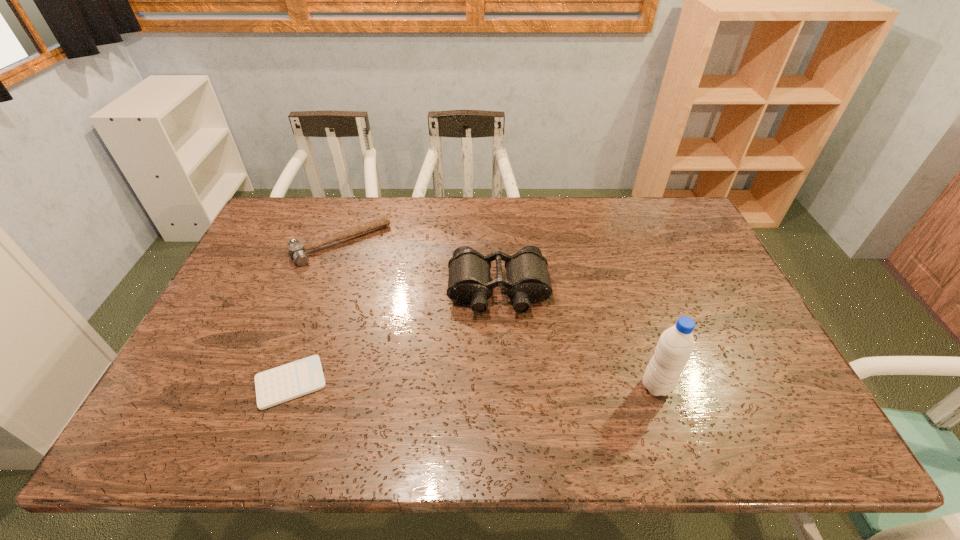
Find the location of a particular element. This screenshot has height=540, width=960. empty space that is in between the tallest object and the shortest object is located at coordinates (473, 384).

The image size is (960, 540). What are the coordinates of `vacant area that lies between the hammer and the calculator` in the screenshot? It's located at (316, 313).

The width and height of the screenshot is (960, 540). I want to click on vacant area between the second shortest object and the binoculars, so click(x=420, y=267).

The width and height of the screenshot is (960, 540). In order to click on empty location between the rightmost object and the shortest object in this screenshot , I will do `click(473, 384)`.

Locate an element on the screen. The image size is (960, 540). free spot between the tallest object and the third tallest object is located at coordinates (498, 315).

Identify the location of unoccupied area between the third tallest object and the rightmost object. The width and height of the screenshot is (960, 540). (498, 315).

The width and height of the screenshot is (960, 540). I want to click on object that is the closest to the second tallest object, so click(297, 251).

Locate an element on the screen. The width and height of the screenshot is (960, 540). object that stands as the third closest to the water bottle is located at coordinates (297, 251).

Where is `vacant area that satisfies the following two spatial constraints: 1. on the front side of the water bottle; 2. on the left side of the calculator`? The width and height of the screenshot is (960, 540). vacant area that satisfies the following two spatial constraints: 1. on the front side of the water bottle; 2. on the left side of the calculator is located at coordinates (289, 386).

Identify the location of free spot that satisfies the following two spatial constraints: 1. on the front side of the tallest object; 2. on the left side of the third tallest object. The image size is (960, 540). (290, 386).